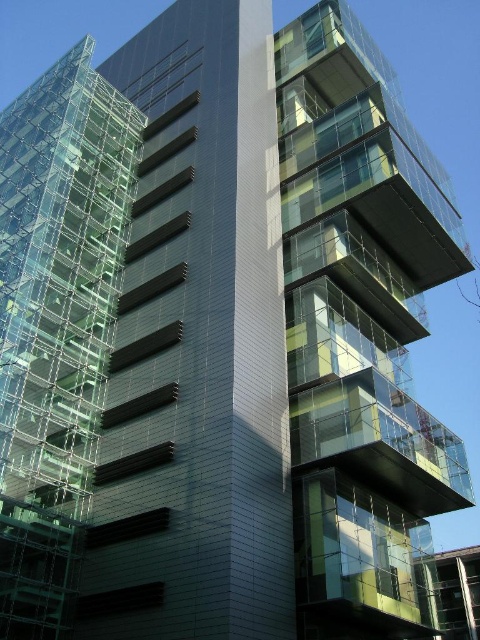
In the scene shown: You are an architect examining the building design. You notice the transparent glass building at upper right and the transparent glass scaffolding at left. Which one is closer to you from your current viewpoint?

The transparent glass building at upper right is closer to you because it is in front of the transparent glass scaffolding at left.

You are an architect evaluating the structural integrity of the transparent glass building at upper right and the transparent glass scaffolding at left. Which one is bigger in size?

The transparent glass building at upper right is larger in size compared to the transparent glass scaffolding at left according to the description.

You are a construction worker standing on the transparent glass scaffolding at left, and you need to reach the transparent glass building at upper right to inspect its facade. The safety regulations state that the distance between the scaffolding and the building must be less than 20 meters for safe inspection. Can you safely perform the inspection from your current position?

The transparent glass building at upper right is 18.78 meters from the transparent glass scaffolding at left. Since the distance is less than 20 meters, you can safely perform the inspection from your current position.